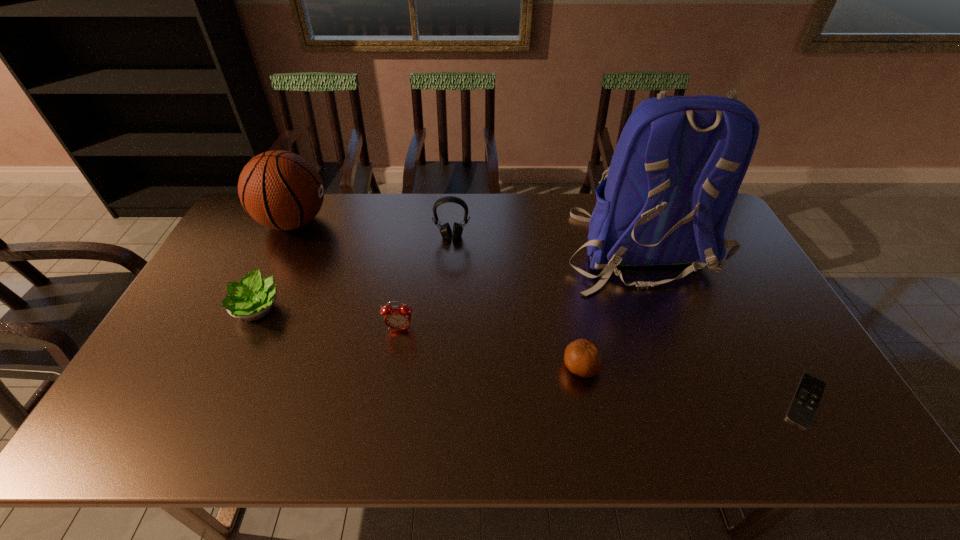
Find the location of a particular element. basketball that is positioned at the left edge is located at coordinates tap(281, 190).

Locate an element on the screen. lettuce that is positioned at the left edge is located at coordinates (252, 298).

Where is `backpack located at the right edge`? This screenshot has height=540, width=960. backpack located at the right edge is located at coordinates (676, 170).

Find the location of `remote control located in the right edge section of the desktop`. remote control located in the right edge section of the desktop is located at coordinates (804, 405).

Image resolution: width=960 pixels, height=540 pixels. In order to click on object that is at the far left corner in this screenshot , I will do `click(281, 190)`.

Find the location of `object at the far right corner`. object at the far right corner is located at coordinates (676, 170).

Locate an element on the screen. The height and width of the screenshot is (540, 960). object that is at the near right corner is located at coordinates (804, 405).

The width and height of the screenshot is (960, 540). I want to click on vacant space at the far edge, so pyautogui.click(x=550, y=211).

Locate an element on the screen. The height and width of the screenshot is (540, 960). free space at the near edge is located at coordinates (238, 432).

I want to click on free space at the left edge of the desktop, so click(x=214, y=344).